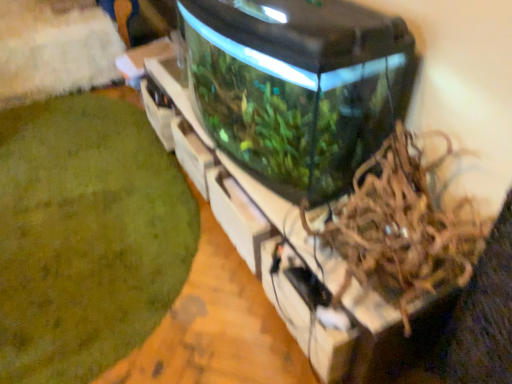
Question: Would you consider brown shredded paper at center-right to be distant from transparent glass water tank at center?

Choices:
 (A) no
 (B) yes

Answer: (A)

Question: Is brown shredded paper at center-right to the left of transparent glass water tank at center from the viewer's perspective?

Choices:
 (A) yes
 (B) no

Answer: (B)

Question: Is brown shredded paper at center-right touching transparent glass water tank at center?

Choices:
 (A) no
 (B) yes

Answer: (A)

Question: Is brown shredded paper at center-right located outside transparent glass water tank at center?

Choices:
 (A) yes
 (B) no

Answer: (A)

Question: Considering the relative sizes of brown shredded paper at center-right and transparent glass water tank at center in the image provided, is brown shredded paper at center-right bigger than transparent glass water tank at center?

Choices:
 (A) no
 (B) yes

Answer: (A)

Question: From a real-world perspective, does brown shredded paper at center-right stand above transparent glass water tank at center?

Choices:
 (A) yes
 (B) no

Answer: (B)

Question: Is green moss at lower left far from transparent glass water tank at center?

Choices:
 (A) yes
 (B) no

Answer: (B)

Question: Considering the relative positions of green moss at lower left and transparent glass water tank at center in the image provided, is green moss at lower left in front of transparent glass water tank at center?

Choices:
 (A) no
 (B) yes

Answer: (A)

Question: Is transparent glass water tank at center at the back of green moss at lower left?

Choices:
 (A) no
 (B) yes

Answer: (A)

Question: Is transparent glass water tank at center completely or partially inside green moss at lower left?

Choices:
 (A) no
 (B) yes

Answer: (A)

Question: Does green moss at lower left have a smaller size compared to transparent glass water tank at center?

Choices:
 (A) no
 (B) yes

Answer: (B)

Question: Considering the relative sizes of green moss at lower left and transparent glass water tank at center in the image provided, is green moss at lower left wider than transparent glass water tank at center?

Choices:
 (A) yes
 (B) no

Answer: (A)

Question: Is transparent glass water tank at center not inside brown shredded paper at center-right?

Choices:
 (A) yes
 (B) no

Answer: (A)